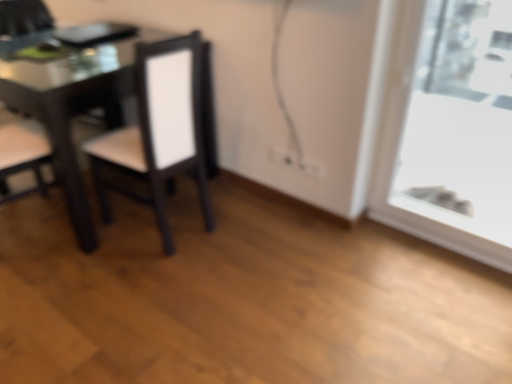
This screenshot has height=384, width=512. I want to click on vacant space to the right of matte black chair at center, which ranks as the 2th chair in left-to-right order, so click(x=246, y=224).